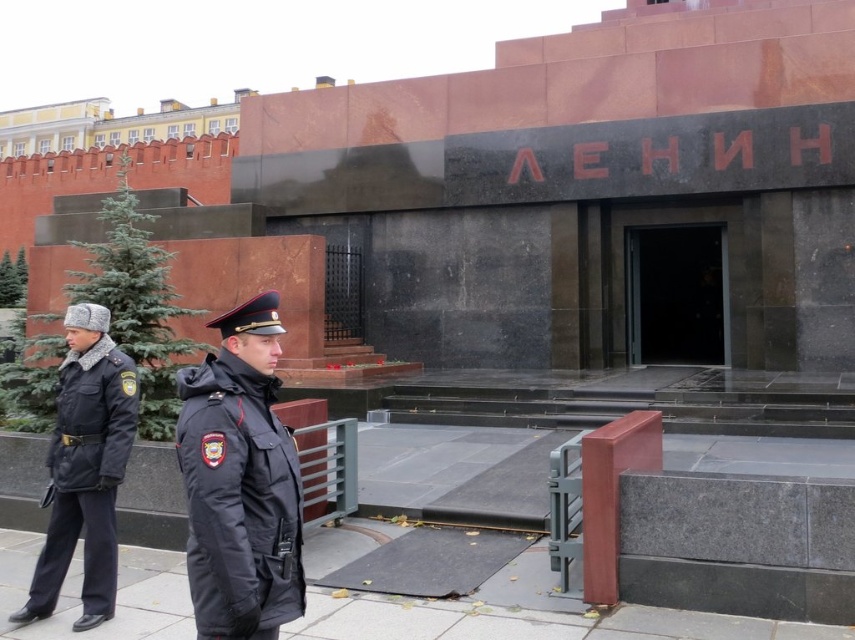
Question: Considering the relative positions of dark blue fabric uniform at left and black matte uniform at left in the image provided, where is dark blue fabric uniform at left located with respect to black matte uniform at left?

Choices:
 (A) above
 (B) below

Answer: (A)

Question: Where is black matte uniform at left located in relation to black glass door at center in the image?

Choices:
 (A) right
 (B) left

Answer: (B)

Question: Is black matte uniform at left smaller than black glass door at center?

Choices:
 (A) no
 (B) yes

Answer: (B)

Question: Based on their relative distances, which object is farther from the black matte uniform at left?

Choices:
 (A) dark blue fabric uniform at left
 (B) black glass door at center

Answer: (B)

Question: Which point is farther to the camera?

Choices:
 (A) (86, 355)
 (B) (225, 580)

Answer: (A)

Question: Which point is farther to the camera?

Choices:
 (A) black glass door at center
 (B) black matte uniform at left

Answer: (A)